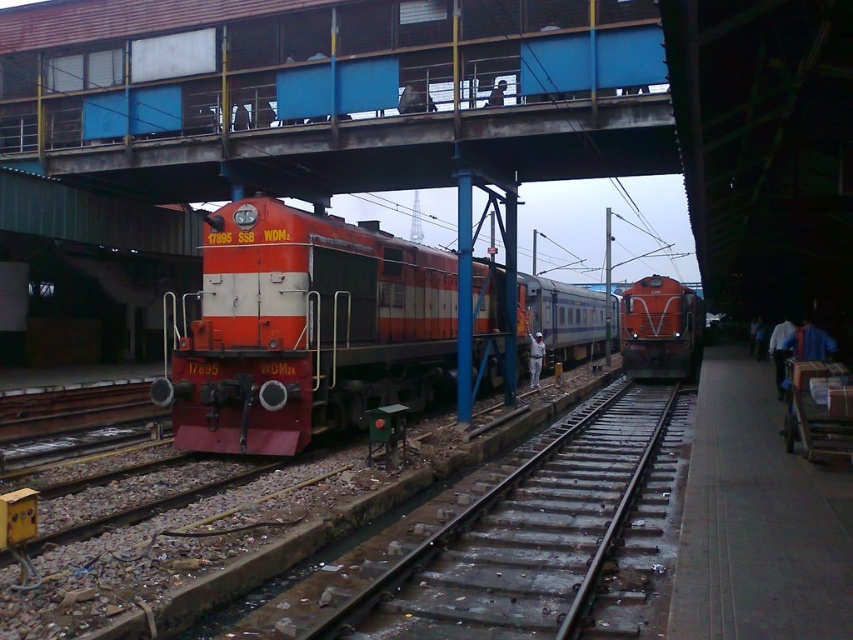
You are standing at the point marked by coordinates point (322, 328) in the railway station. Looking around, you see the orange matte train at center. Which direction should you walk to reach the blue railing? Please respond with either north, south, east, or west.

The blue railing is located to the north of the orange matte train at center. Walk north to reach the blue railing.